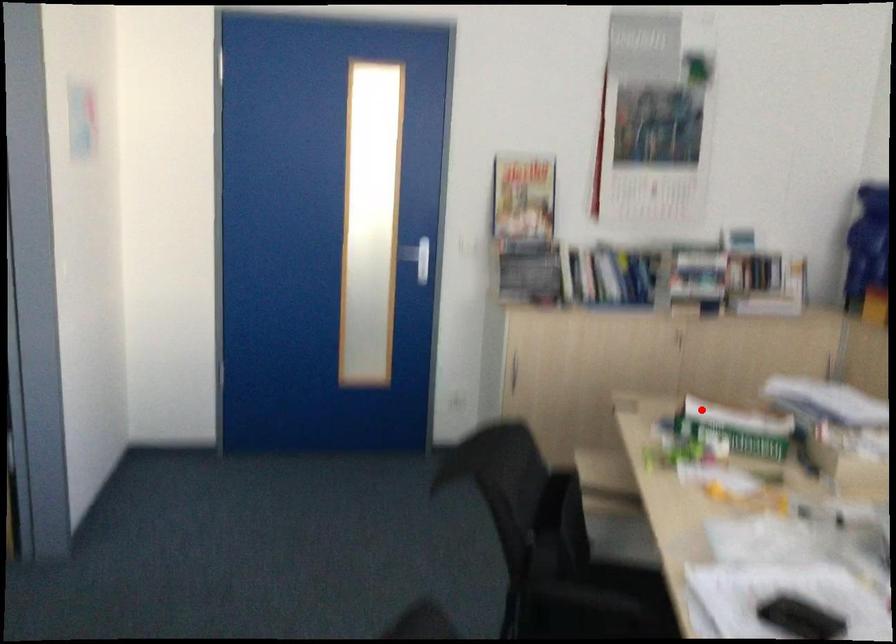
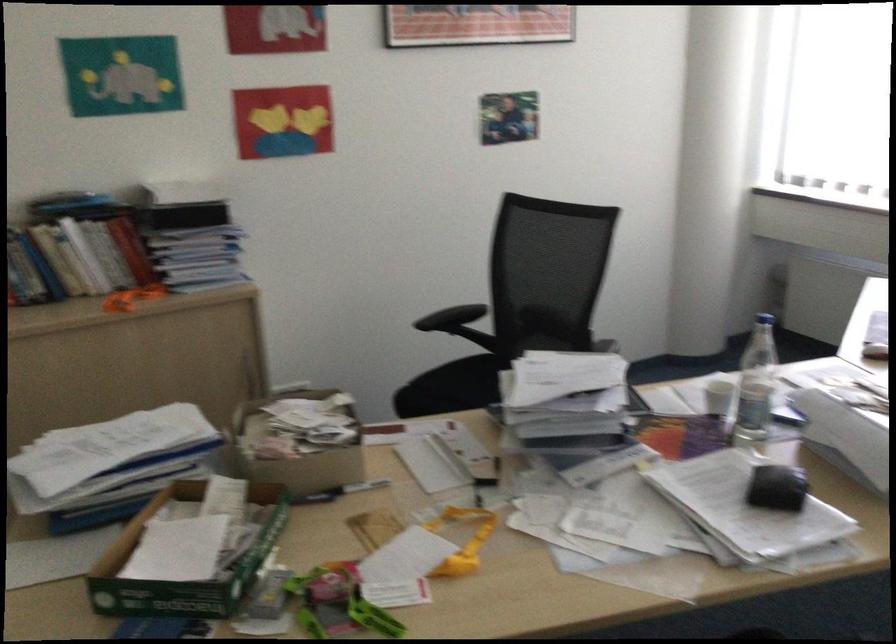
Question: A red point is marked in image1. In image2, is the corresponding 3D point closer to the camera or farther? Reply with the corresponding letter.

Choices:
 (A) The corresponding 3D point is closer.
 (B) The corresponding 3D point is farther.

Answer: (A)